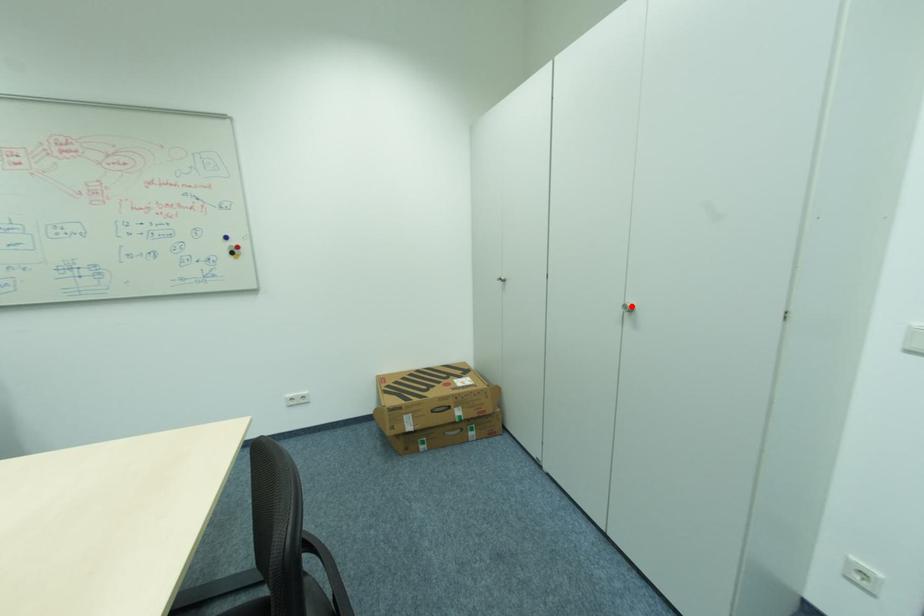
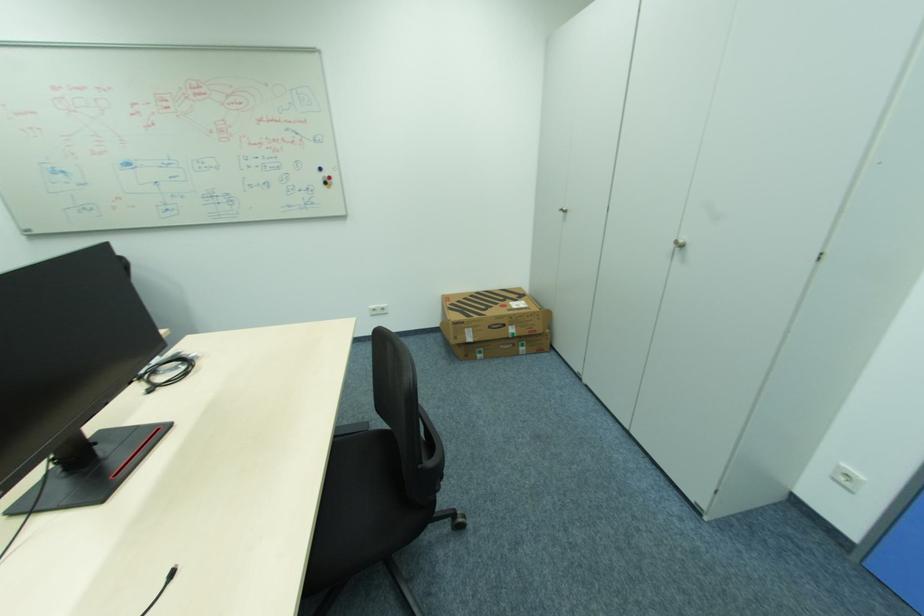
Where in the second image is the point corresponding to the highlighted location from the first image?

(679, 243)